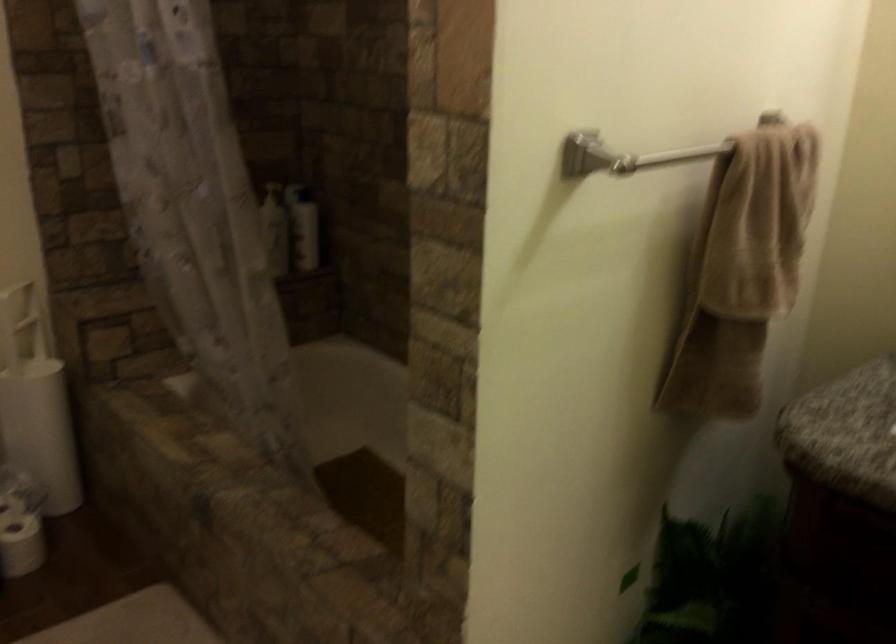
Locate an element on the screen. brown towel is located at coordinates (743, 269).